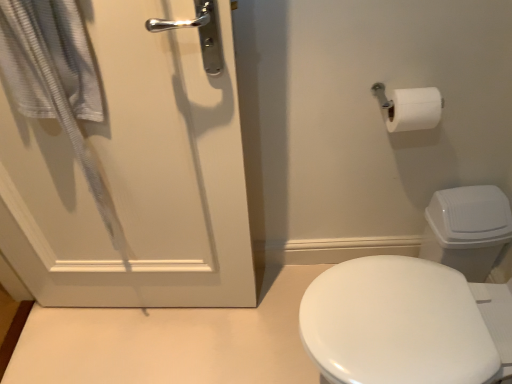
Identify the location of blank space situated above white plastic toilet bowl at right (from a real-world perspective). This screenshot has width=512, height=384. (466, 199).